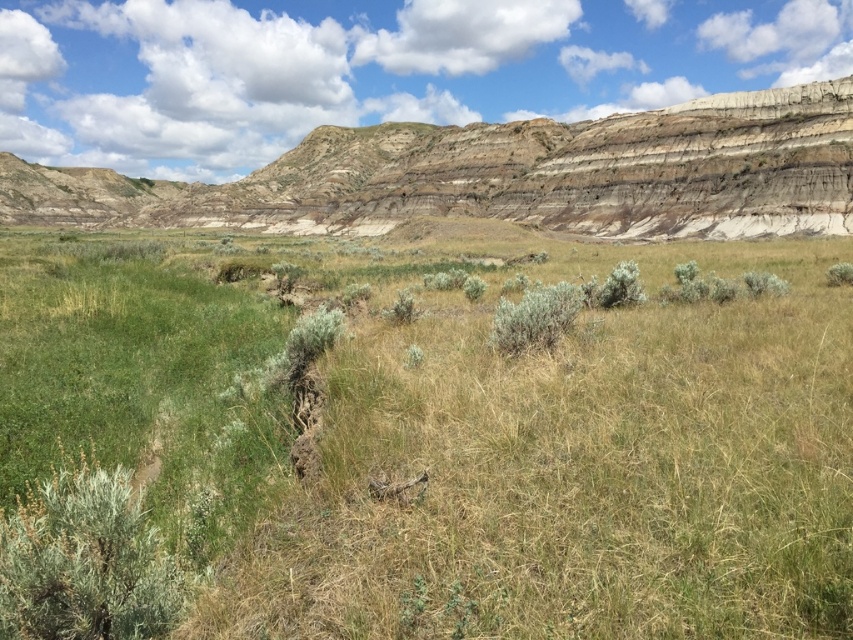
Question: Which object is the closest to the green fuzzy bush at lower left?

Choices:
 (A) green grass at center
 (B) clay-textured cliff at upper center

Answer: (A)

Question: Is green grass at center wider than green fuzzy bush at center?

Choices:
 (A) yes
 (B) no

Answer: (A)

Question: Considering the relative positions of clay-textured cliff at upper center and green fuzzy bush at lower left in the image provided, where is clay-textured cliff at upper center located with respect to green fuzzy bush at lower left?

Choices:
 (A) above
 (B) below

Answer: (A)

Question: Can you confirm if clay-textured cliff at upper center is positioned to the left of green fuzzy bush at lower left?

Choices:
 (A) no
 (B) yes

Answer: (B)

Question: Which point appears farthest from the camera in this image?

Choices:
 (A) (730, 180)
 (B) (502, 339)
 (C) (100, 500)

Answer: (A)

Question: Estimate the real-world distances between objects in this image. Which object is farther from the green grass at center?

Choices:
 (A) green fuzzy bush at lower left
 (B) green fuzzy bush at center
 (C) clay-textured cliff at upper center

Answer: (C)